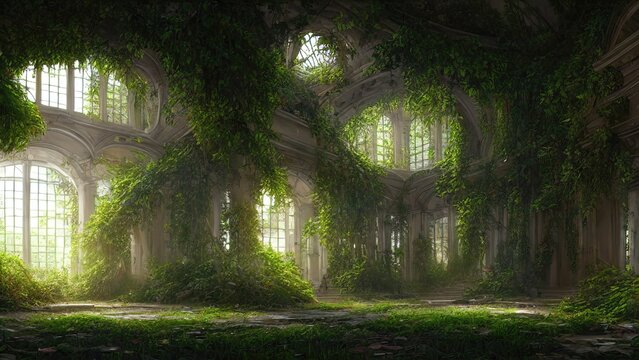
Where is `ceiling windows`? Image resolution: width=639 pixels, height=360 pixels. ceiling windows is located at coordinates (316, 60).